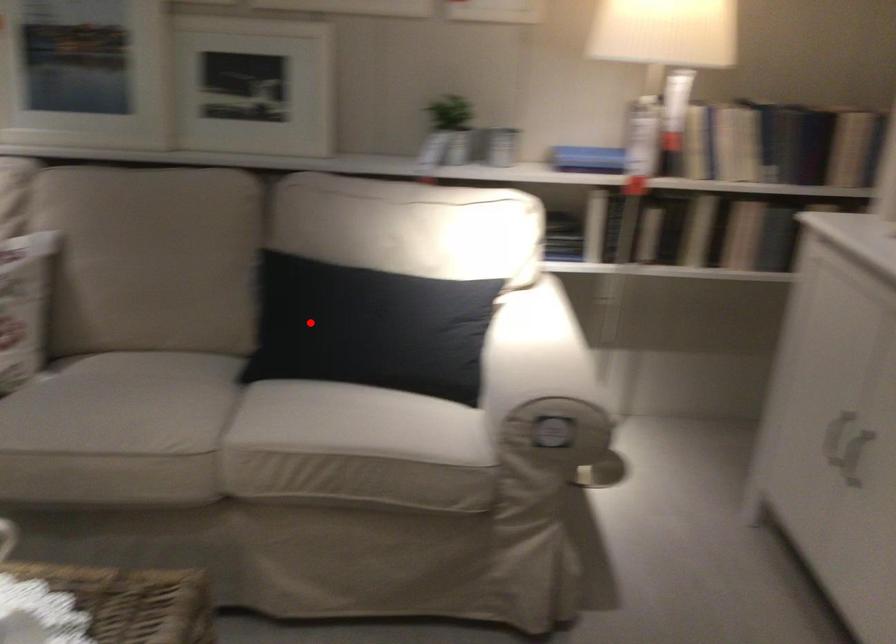
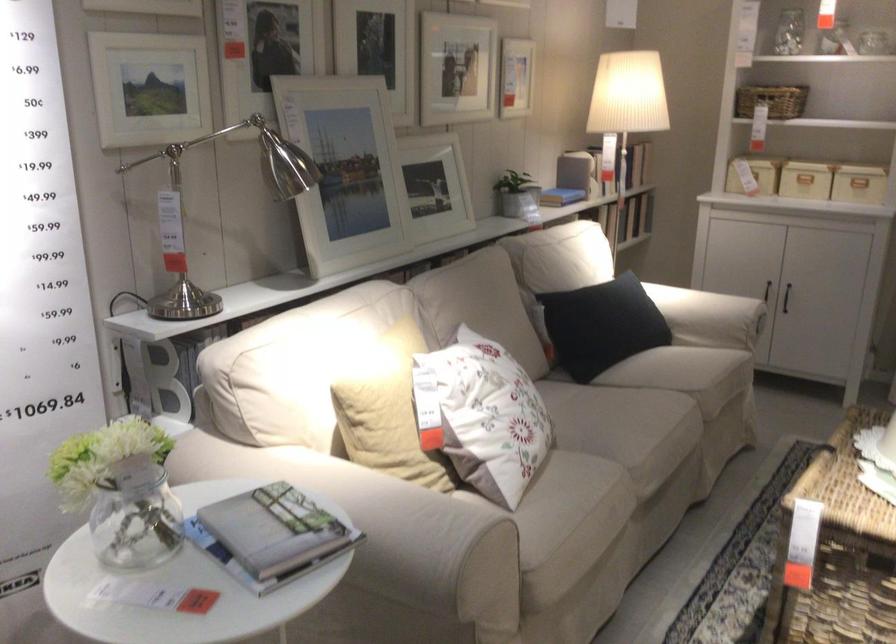
Question: I am providing you with two images of the same scene from different viewpoints. Image1 has a red point marked. In image2, the corresponding 3D location appears at what relative position? Reply with the corresponding letter.

Choices:
 (A) Closer
 (B) Farther

Answer: (B)